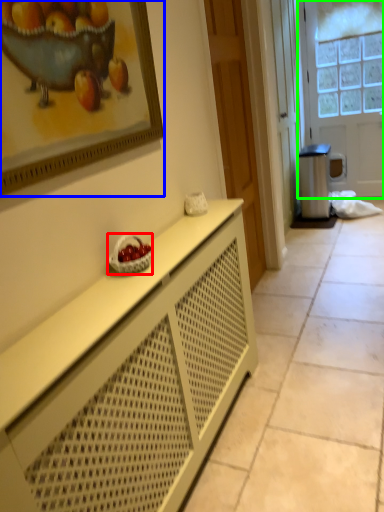
Question: Based on their relative distances, which object is farther from fruit dish (highlighted by a red box)? Choose from picture frame (highlighted by a blue box) and door (highlighted by a green box).

Choices:
 (A) picture frame
 (B) door

Answer: (B)